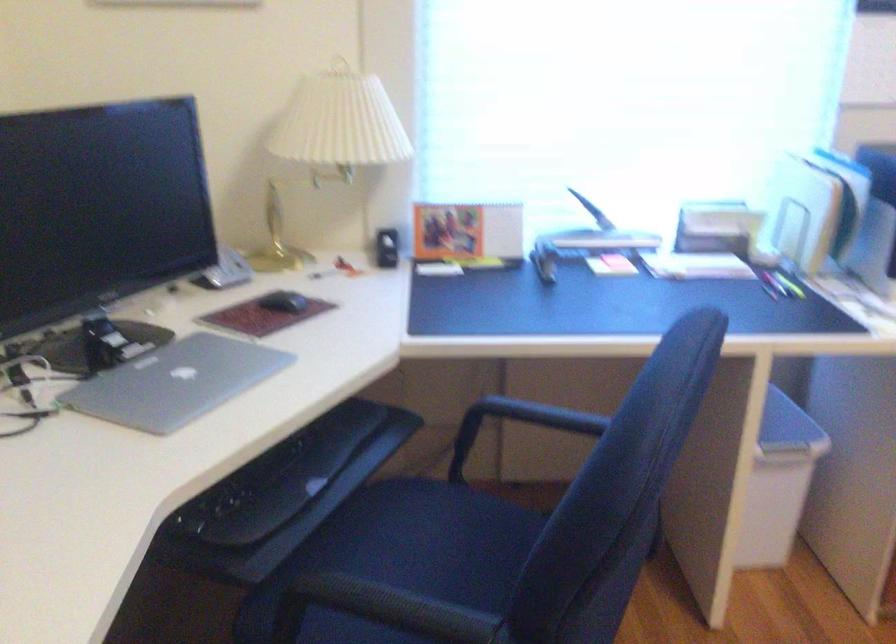
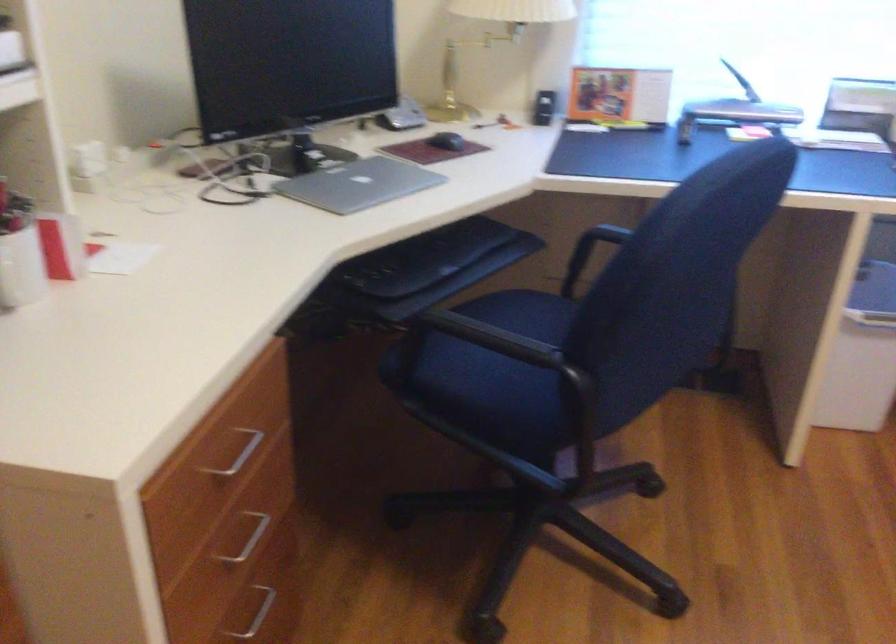
In the second image, find the point that corresponds to (x=760, y=494) in the first image.

(862, 355)